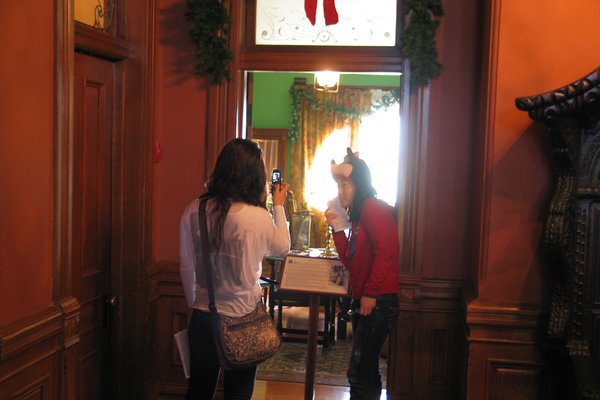
The image size is (600, 400). Find the location of `doorknob`. doorknob is located at coordinates (109, 298).